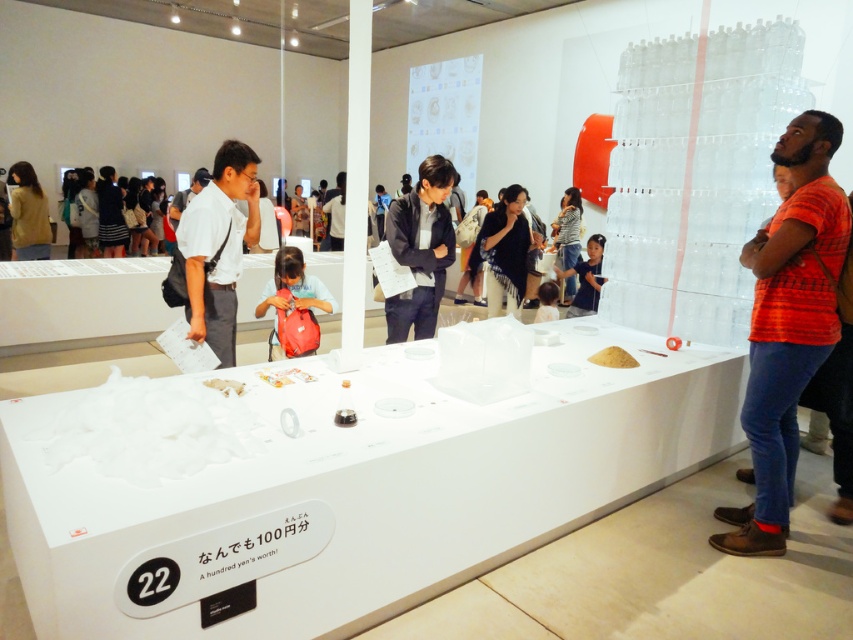
Between white shirt at center and dark gray jacket at center, which one has less height?

Standing shorter between the two is white shirt at center.

Between white shirt at center and dark gray jacket at center, which one is positioned lower?

dark gray jacket at center

Find the location of `white shirt at center`. white shirt at center is located at coordinates (218, 246).

The width and height of the screenshot is (853, 640). What are the coordinates of `white shirt at center` in the screenshot? It's located at (218, 246).

How much distance is there between orange striped shirt at right and black fringe scarf at center?

The distance of orange striped shirt at right from black fringe scarf at center is 8.79 feet.

Where is `orange striped shirt at right`? This screenshot has width=853, height=640. orange striped shirt at right is located at coordinates (787, 324).

Which is more to the left, dark gray jacket at center or striped shirt at center?

From the viewer's perspective, dark gray jacket at center appears more on the left side.

Is point (412, 214) more distant than point (578, 192)?

No, (412, 214) is in front of (578, 192).

Image resolution: width=853 pixels, height=640 pixels. I want to click on dark gray jacket at center, so click(421, 250).